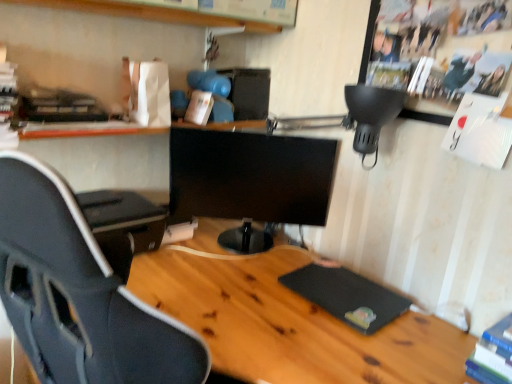
What is the approximate height of black rubber mousepad at lower right?

1.09 inches.

This screenshot has width=512, height=384. What do you see at coordinates (199, 108) in the screenshot?
I see `white matte book at upper center, the second book when ordered from front to back` at bounding box center [199, 108].

The width and height of the screenshot is (512, 384). In order to click on blue hardcover book at lower right, which is the 1th book from bottom to top in this screenshot , I will do `click(493, 355)`.

At what (x,y) coordinates should I click in order to perform the action: click on black rubber mousepad at lower right. Please return your answer as a coordinate pair (x, y). The image size is (512, 384). Looking at the image, I should click on (347, 296).

Where is `pad on the left side of blue hardcover book at lower right, which is the 1th book from bottom to top`? Image resolution: width=512 pixels, height=384 pixels. pad on the left side of blue hardcover book at lower right, which is the 1th book from bottom to top is located at coordinates (347, 296).

Are black rubber mousepad at lower right and blue hardcover book at lower right, marked as the first book in a right-to-left arrangement, located far from each other?

black rubber mousepad at lower right is actually quite close to blue hardcover book at lower right, marked as the first book in a right-to-left arrangement.

Looking at the image, does black rubber mousepad at lower right seem bigger or smaller compared to blue hardcover book at lower right, which appears as the 2th book when viewed from the left?

In the image, black rubber mousepad at lower right appears to be smaller than blue hardcover book at lower right, which appears as the 2th book when viewed from the left.

Between black rubber mousepad at lower right and blue hardcover book at lower right, the 1th book positioned from the front, which one appears on the right side from the viewer's perspective?

blue hardcover book at lower right, the 1th book positioned from the front.

Which object is positioned more to the right, white matte book at upper center, the 2th book when ordered from bottom to top, or black rubber mousepad at lower right?

From the viewer's perspective, black rubber mousepad at lower right appears more on the right side.

From a real-world perspective, which object rests below the other?

In real-world perspective, black rubber mousepad at lower right is lower.

Is white matte book at upper center, the first book viewed from the left, looking in the opposite direction of black rubber mousepad at lower right?

white matte book at upper center, the first book viewed from the left, is not turned away from black rubber mousepad at lower right.

Is black glossy monitor at center wider than black rubber mousepad at lower right?

No, black glossy monitor at center is not wider than black rubber mousepad at lower right.

Considering the positions of objects black glossy monitor at center and black rubber mousepad at lower right in the image provided, who is more to the right, black glossy monitor at center or black rubber mousepad at lower right?

From the viewer's perspective, black rubber mousepad at lower right appears more on the right side.

Is black glossy monitor at center next to black rubber mousepad at lower right and touching it?

No, black glossy monitor at center is not in contact with black rubber mousepad at lower right.

Is black glossy monitor at center positioned beyond the bounds of black rubber mousepad at lower right?

black glossy monitor at center is positioned outside black rubber mousepad at lower right.

Is blue hardcover book at lower right, the 1th book positioned from the front, spatially inside wooden shelf at upper center, or outside of it?

blue hardcover book at lower right, the 1th book positioned from the front, is not inside wooden shelf at upper center, it's outside.

Could you tell me if blue hardcover book at lower right, which ranks as the second book in top-to-bottom order, is turned towards wooden shelf at upper center?

No, blue hardcover book at lower right, which ranks as the second book in top-to-bottom order, does not turn towards wooden shelf at upper center.

Does blue hardcover book at lower right, the 2th book viewed from the back, lie in front of wooden shelf at upper center?

Yes, blue hardcover book at lower right, the 2th book viewed from the back, is in front of wooden shelf at upper center.

From the image's perspective, which one is positioned higher, blue hardcover book at lower right, marked as the first book in a right-to-left arrangement, or wooden shelf at upper center?

From the image's view, wooden shelf at upper center is above.

Between white matte book at upper center, the 2th book when ordered from bottom to top, and black glossy monitor at center, which one has smaller size?

white matte book at upper center, the 2th book when ordered from bottom to top.

Which is closer to the camera, (209, 108) or (253, 216)?

The point (209, 108) is more forward.

Is white matte book at upper center, the first book viewed from the left, touching black glossy monitor at center?

white matte book at upper center, the first book viewed from the left, and black glossy monitor at center are not in contact.

This screenshot has width=512, height=384. I want to click on computer monitor lying below the white matte book at upper center, the second book when ordered from front to back (from the image's perspective), so click(250, 181).

From a real-world perspective, is white matte book at upper center, positioned as the second book in right-to-left order, below blue hardcover book at lower right, marked as the first book in a right-to-left arrangement?

No, from a real-world perspective, white matte book at upper center, positioned as the second book in right-to-left order, is not below blue hardcover book at lower right, marked as the first book in a right-to-left arrangement.

From the image's perspective, is white matte book at upper center, the second book when ordered from front to back, under blue hardcover book at lower right, the 2th book viewed from the back?

No, from the image's perspective, white matte book at upper center, the second book when ordered from front to back, is not below blue hardcover book at lower right, the 2th book viewed from the back.

Between white matte book at upper center, which is the 1th book from back to front, and blue hardcover book at lower right, which ranks as the second book in top-to-bottom order, which one has smaller width?

With smaller width is white matte book at upper center, which is the 1th book from back to front.

Is white matte book at upper center, positioned as the second book in right-to-left order, spatially inside blue hardcover book at lower right, which appears as the 2th book when viewed from the left, or outside of it?

white matte book at upper center, positioned as the second book in right-to-left order, cannot be found inside blue hardcover book at lower right, which appears as the 2th book when viewed from the left.

Is blue hardcover book at lower right, the 1th book positioned from the front, positioned far away from black rubber mousepad at lower right?

No.

The height and width of the screenshot is (384, 512). What are the coordinates of `book below the black rubber mousepad at lower right (from the image's perspective)` in the screenshot? It's located at (493, 355).

Can you tell me how much blue hardcover book at lower right, which appears as the 2th book when viewed from the left, and black rubber mousepad at lower right differ in facing direction?

They differ by 3.4 degrees in their facing directions.

Could you tell me if blue hardcover book at lower right, which is the 1th book from bottom to top, is turned towards black rubber mousepad at lower right?

No, blue hardcover book at lower right, which is the 1th book from bottom to top, is not oriented towards black rubber mousepad at lower right.

At what (x,y) coordinates should I click in order to perform the action: click on book on the right of black rubber mousepad at lower right. Please return your answer as a coordinate pair (x, y). This screenshot has width=512, height=384. Looking at the image, I should click on (493, 355).

Identify the location of book behind the black rubber mousepad at lower right. This screenshot has height=384, width=512. (199, 108).

Which object lies further to the anchor point wooden desk at center, wooden shelf at upper center or blue hardcover book at lower right, the 2th book viewed from the back?

The object further to wooden desk at center is wooden shelf at upper center.

Considering their positions, is wooden desk at center positioned further to black rubber mousepad at lower right than wooden shelf at upper center?

wooden shelf at upper center is further to black rubber mousepad at lower right.

Which object lies nearer to the anchor point black glossy monitor at center, blue hardcover book at lower right, the 1th book positioned from the front, or white matte book at upper center, the 1th book in the top-to-bottom sequence?

white matte book at upper center, the 1th book in the top-to-bottom sequence.

Based on their spatial positions, is black glossy monitor at center or blue hardcover book at lower right, which ranks as the second book in top-to-bottom order, closer to wooden shelf at upper center?

Among the two, black glossy monitor at center is located nearer to wooden shelf at upper center.

Based on their spatial positions, is black rubber mousepad at lower right or white matte book at upper center, the second book when ordered from front to back, closer to blue hardcover book at lower right, the 2th book viewed from the back?

black rubber mousepad at lower right.

Considering their positions, is white matte book at upper center, the second book when ordered from front to back, positioned further to blue hardcover book at lower right, which is the 1th book from bottom to top, than wooden desk at center?

white matte book at upper center, the second book when ordered from front to back, is positioned further to the anchor blue hardcover book at lower right, which is the 1th book from bottom to top.

Consider the image. Which object lies further to the anchor point blue hardcover book at lower right, which is the 1th book from bottom to top, wooden desk at center or white matte book at upper center, positioned as the second book in right-to-left order?

white matte book at upper center, positioned as the second book in right-to-left order, is positioned further to the anchor blue hardcover book at lower right, which is the 1th book from bottom to top.

Considering their positions, is black rubber mousepad at lower right positioned further to blue hardcover book at lower right, which is the 1th book from bottom to top, than wooden shelf at upper center?

wooden shelf at upper center is positioned further to the anchor blue hardcover book at lower right, which is the 1th book from bottom to top.

At what (x,y) coordinates should I click in order to perform the action: click on book positioned between wooden desk at center and black glossy monitor at center from near to far. Please return your answer as a coordinate pair (x, y). This screenshot has height=384, width=512. Looking at the image, I should click on (493, 355).

You are a GUI agent. You are given a task and a screenshot of the screen. Output one action in this format:
    pyautogui.click(x=<x>, y=<y>)
    Task: Click on the computer monitor that lies between wooden shelf at upper center and blue hardcover book at lower right, which appears as the 2th book when viewed from the left, from top to bottom
    This screenshot has height=384, width=512.
    Given the screenshot: What is the action you would take?
    pyautogui.click(x=250, y=181)

Where is `book that lies between white matte book at upper center, the 2th book when ordered from bottom to top, and wooden desk at center from top to bottom`? The height and width of the screenshot is (384, 512). book that lies between white matte book at upper center, the 2th book when ordered from bottom to top, and wooden desk at center from top to bottom is located at coordinates (493, 355).

Locate an element on the screen. pad located between wooden desk at center and black glossy monitor at center in the depth direction is located at coordinates tap(347, 296).